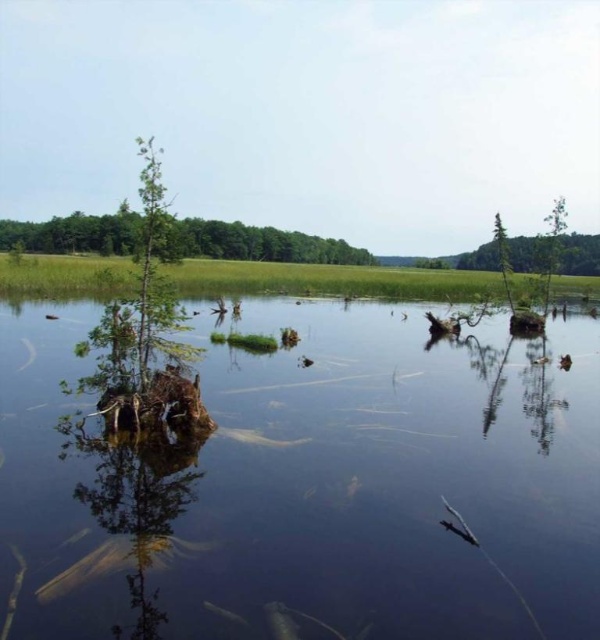
You are standing on a wooden dock overlooking the wetland. You see the clear water at center and the translucent greenish fish at center. Which object is closer to you?

The clear water at center is closer to the viewer than the translucent greenish fish at center.

You are a photographer trying to capture the translucent clear fish at lower center through the clear water at center. Can you see the fish clearly from above the water?

The clear water at center is positioned over the translucent clear fish at lower center, so yes, you can see the fish clearly from above the water since the water is clear and allows visibility.

You are standing at the edge of the wetland and see a point marked at coordinates (577, 570). If you want to reach that point without getting your shoes wet, is it possible? The wetland has calm water reflecting the surroundings with partially submerged trees and branches in the foreground. The middle ground has lush vegetation extending to the water edge, and the background has a dense forest.

The point at coordinates (577, 570) is 4.14 meters away from the viewer. Since the wetland has calm water with partially submerged trees and branches in the foreground, and the middle ground has lush vegetation extending to the water edge, it is likely that the point is within the water area. Therefore, reaching it without getting your shoes wet might not be possible unless there is a dry path through the vegetation or around the water.